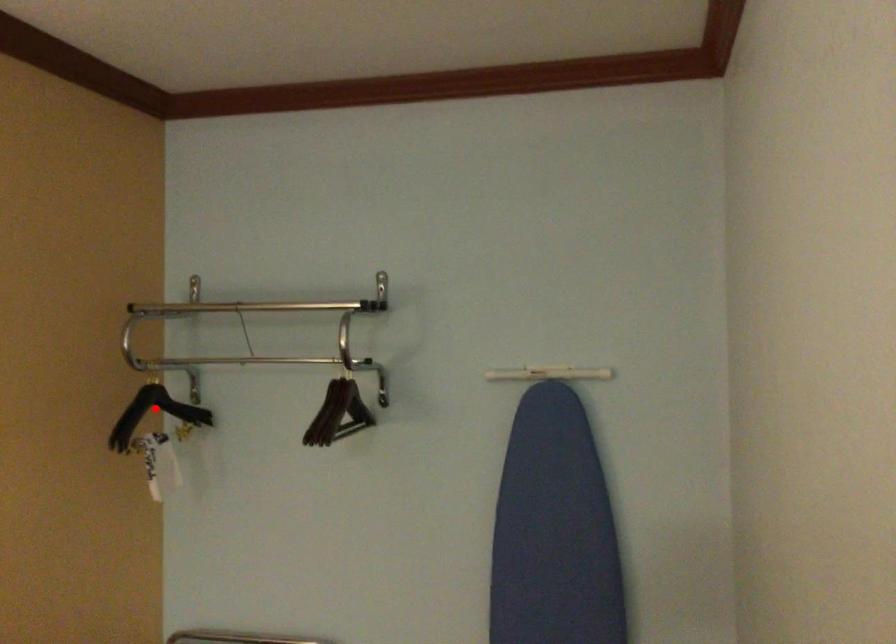
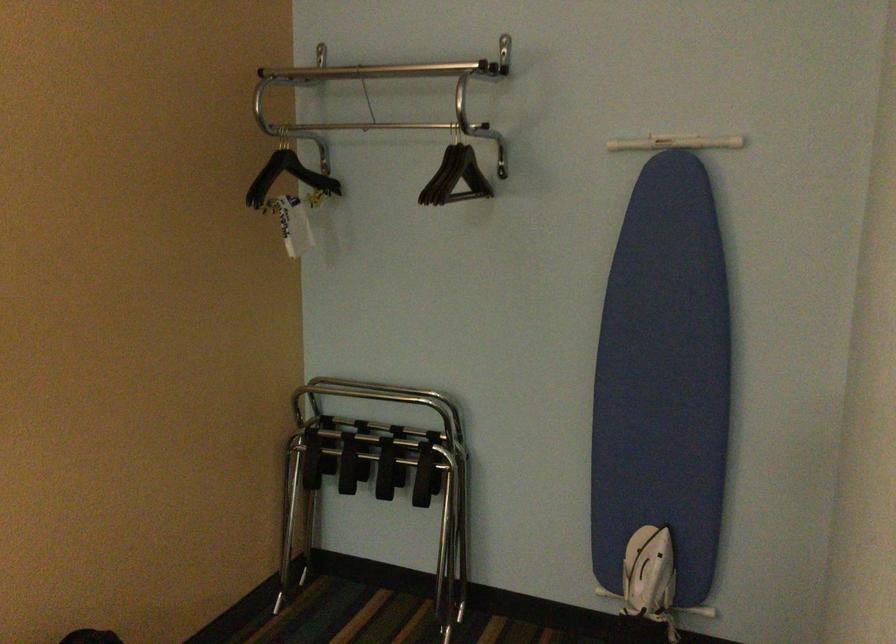
In the second image, find the point that corresponds to the highlighted location in the first image.

(288, 176)